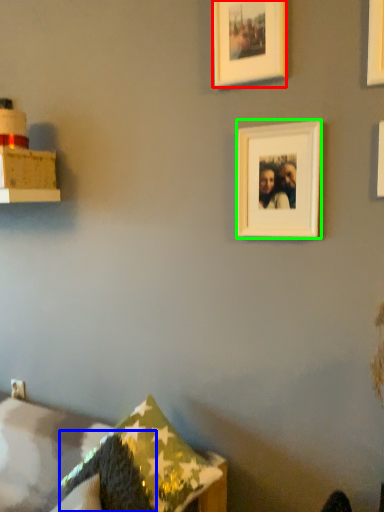
Question: Which object is the closest to the picture frame (highlighted by a red box)? Choose among these: pillow (highlighted by a blue box) or picture frame (highlighted by a green box).

Choices:
 (A) pillow
 (B) picture frame

Answer: (B)